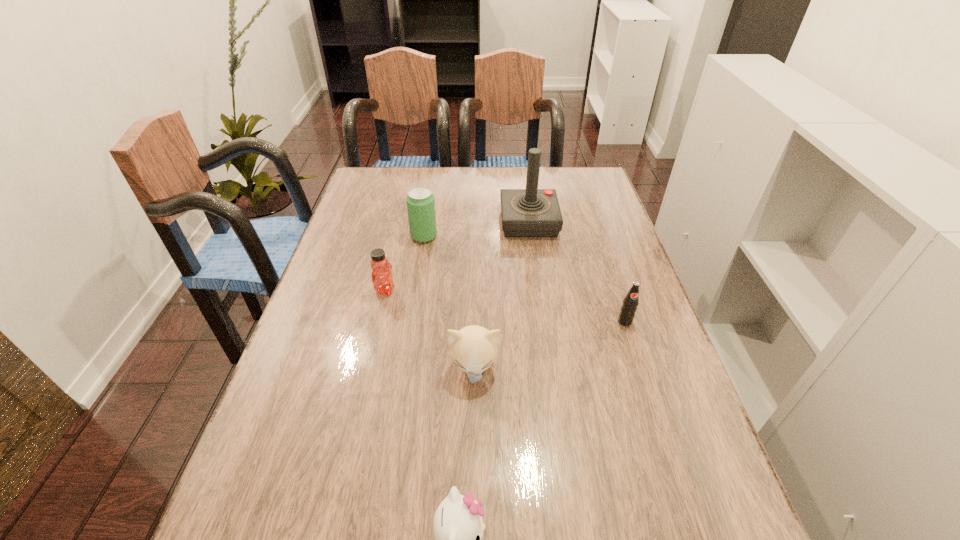
Find the location of `joystick`. joystick is located at coordinates (531, 212).

You are a GUI agent. You are given a task and a screenshot of the screen. Output one action in this format:
    pyautogui.click(x=<x>, y=<y>)
    Task: Click on the tallest object
    This screenshot has height=540, width=960.
    Given the screenshot: What is the action you would take?
    pyautogui.click(x=531, y=212)

The height and width of the screenshot is (540, 960). What are the coordinates of `the farther pop` in the screenshot? It's located at (420, 201).

I want to click on the left pop, so click(x=420, y=201).

In order to click on the farther kitten in this screenshot , I will do `click(473, 349)`.

Identify the location of honey. This screenshot has width=960, height=540. (382, 279).

Where is `the leftmost object`? Image resolution: width=960 pixels, height=540 pixels. the leftmost object is located at coordinates (382, 279).

Where is `the third nearest object`? The width and height of the screenshot is (960, 540). the third nearest object is located at coordinates (630, 302).

Locate an element on the screen. This screenshot has width=960, height=540. the right pop is located at coordinates (630, 302).

Locate an element on the screen. This screenshot has height=540, width=960. free region located 0.210m on the rectangular base of the fifth object from left to right is located at coordinates (435, 222).